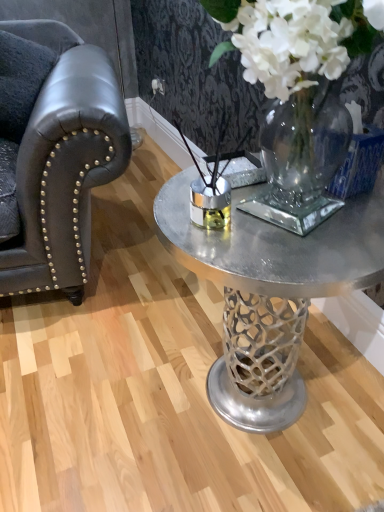
Question: Can you confirm if metallic silver coffee table at center is bigger than clear glass vase at center?

Choices:
 (A) yes
 (B) no

Answer: (B)

Question: Is metallic silver coffee table at center aimed at clear glass vase at center?

Choices:
 (A) no
 (B) yes

Answer: (A)

Question: Does metallic silver coffee table at center touch clear glass vase at center?

Choices:
 (A) yes
 (B) no

Answer: (B)

Question: From a real-world perspective, is metallic silver coffee table at center below clear glass vase at center?

Choices:
 (A) no
 (B) yes

Answer: (B)

Question: Is the position of metallic silver coffee table at center less distant than that of clear glass vase at center?

Choices:
 (A) no
 (B) yes

Answer: (A)

Question: Does metallic silver coffee table at center come behind clear glass vase at center?

Choices:
 (A) no
 (B) yes

Answer: (B)

Question: Can you confirm if matte black leather armchair at left is wider than metallic silver coffee table at center?

Choices:
 (A) yes
 (B) no

Answer: (A)

Question: Does matte black leather armchair at left have a lesser width compared to metallic silver coffee table at center?

Choices:
 (A) no
 (B) yes

Answer: (A)

Question: Considering the relative sizes of matte black leather armchair at left and metallic silver coffee table at center in the image provided, is matte black leather armchair at left bigger than metallic silver coffee table at center?

Choices:
 (A) yes
 (B) no

Answer: (A)

Question: Is matte black leather armchair at left closer to the viewer compared to metallic silver coffee table at center?

Choices:
 (A) yes
 (B) no

Answer: (A)

Question: Does matte black leather armchair at left come behind metallic silver coffee table at center?

Choices:
 (A) yes
 (B) no

Answer: (B)

Question: Considering the relative positions of matte black leather armchair at left and metallic silver coffee table at center in the image provided, is matte black leather armchair at left to the left of metallic silver coffee table at center from the viewer's perspective?

Choices:
 (A) no
 (B) yes

Answer: (B)

Question: Is matte black leather armchair at left not within dark leather armrest at left?

Choices:
 (A) yes
 (B) no

Answer: (A)